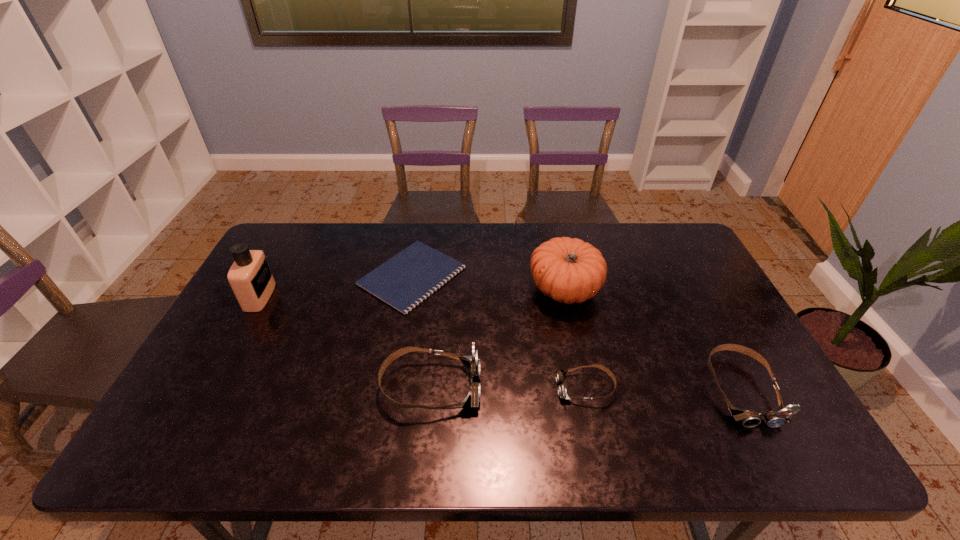
Where is `the leftmost goggles`? the leftmost goggles is located at coordinates (471, 363).

At what (x,y) coordinates should I click in order to perform the action: click on the second goggles from right to left. Please return your answer as a coordinate pair (x, y). Looking at the image, I should click on (560, 374).

I want to click on the second shortest object, so click(x=560, y=374).

Identify the location of the rightmost goggles. Image resolution: width=960 pixels, height=540 pixels. (748, 418).

Where is `the rightmost object`? the rightmost object is located at coordinates (748, 418).

In order to click on the shortest object in this screenshot , I will do `click(405, 280)`.

Find the location of a particular element. This screenshot has height=540, width=960. pumpkin is located at coordinates (569, 270).

What are the coordinates of `perfume` in the screenshot? It's located at (250, 277).

Find the location of a particular element. This screenshot has height=540, width=960. the tallest object is located at coordinates (250, 277).

This screenshot has height=540, width=960. I want to click on vacant area situated 0.100m on the front-facing side of the leftmost goggles, so click(x=520, y=387).